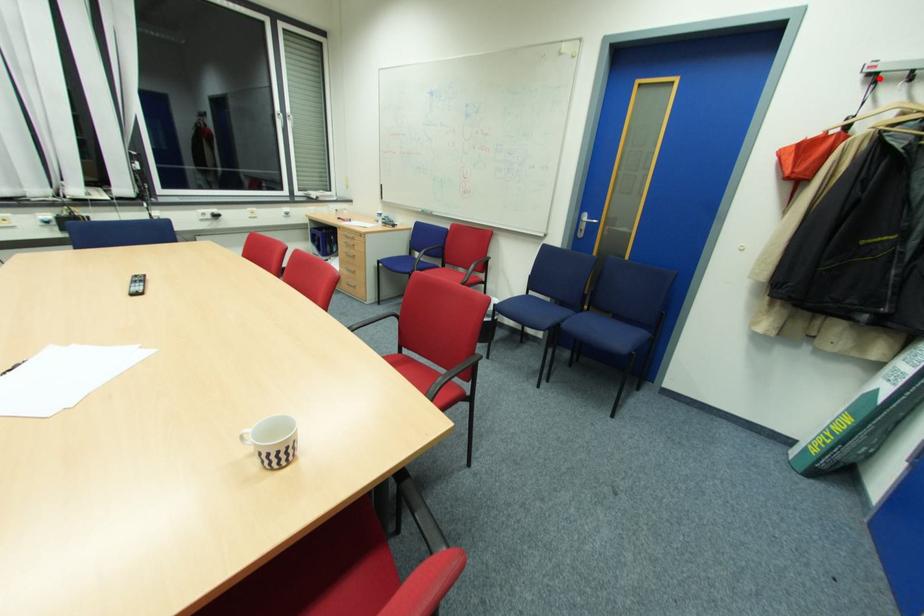
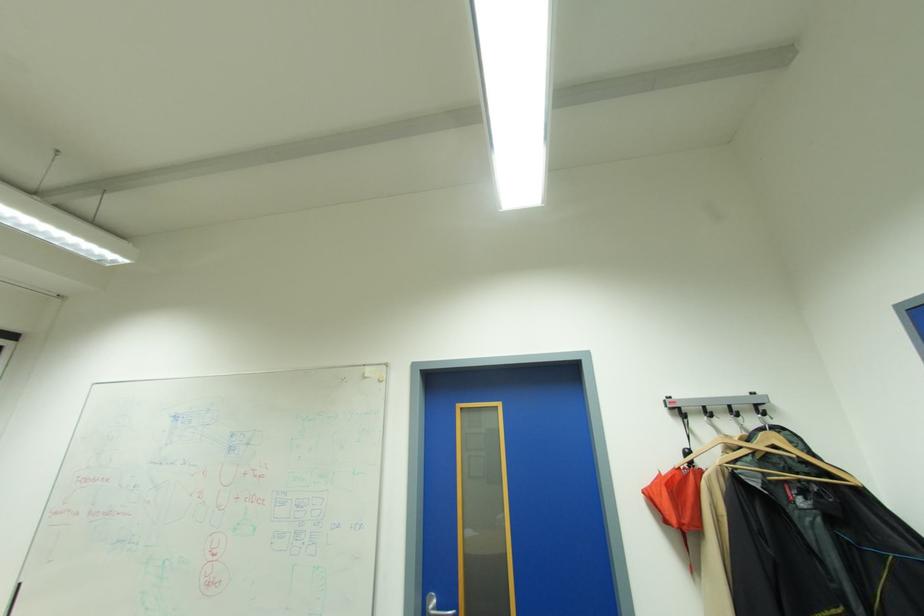
Question: I am providing you with two images of the same scene from different viewpoints. Given a red point in image1, look at the same physical point in image2. Is it:

Choices:
 (A) Closer to the viewpoint
 (B) Farther from the viewpoint

Answer: (A)